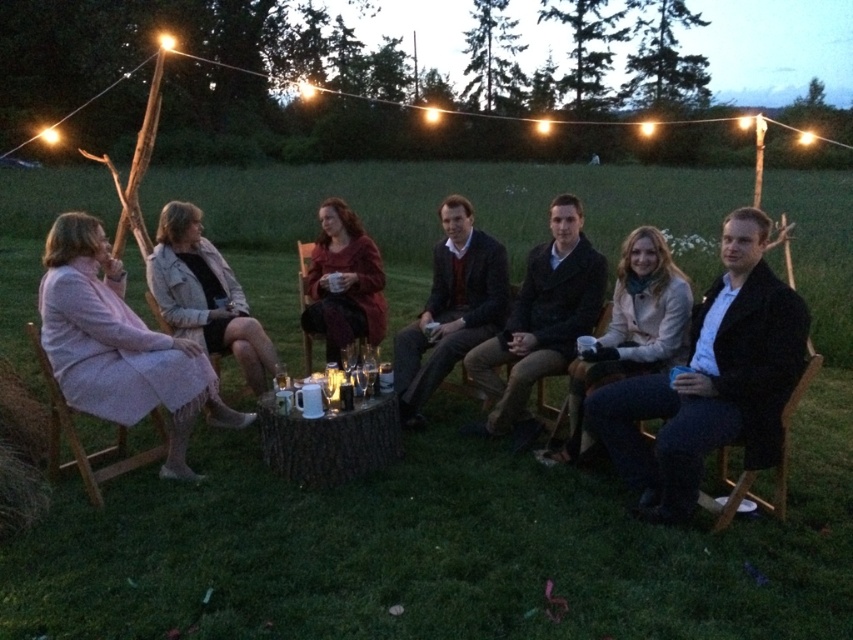
Does dark blue jeans at center have a larger size compared to light pink fabric dress at left?

No.

Who is more distant from viewer, (x=778, y=298) or (x=100, y=282)?

The point (x=100, y=282) is behind.

Who is more forward, (701, 381) or (74, 218)?

Point (701, 381) is in front.

Locate an element on the screen. dark blue jeans at center is located at coordinates (711, 380).

Between wooden chair at left and wooden chair at center, which one has more height?

With more height is wooden chair at left.

Between point (114, 467) and point (467, 348), which one is positioned in front?

Point (114, 467) is in front.

The width and height of the screenshot is (853, 640). Identify the location of wooden chair at left. (79, 440).

Find the location of a particular element. light beige coat at center is located at coordinates (630, 330).

Between point (663, 252) and point (509, 284), which one is positioned in front?

Positioned in front is point (663, 252).

Locate an element on the screen. The image size is (853, 640). light beige coat at center is located at coordinates (630, 330).